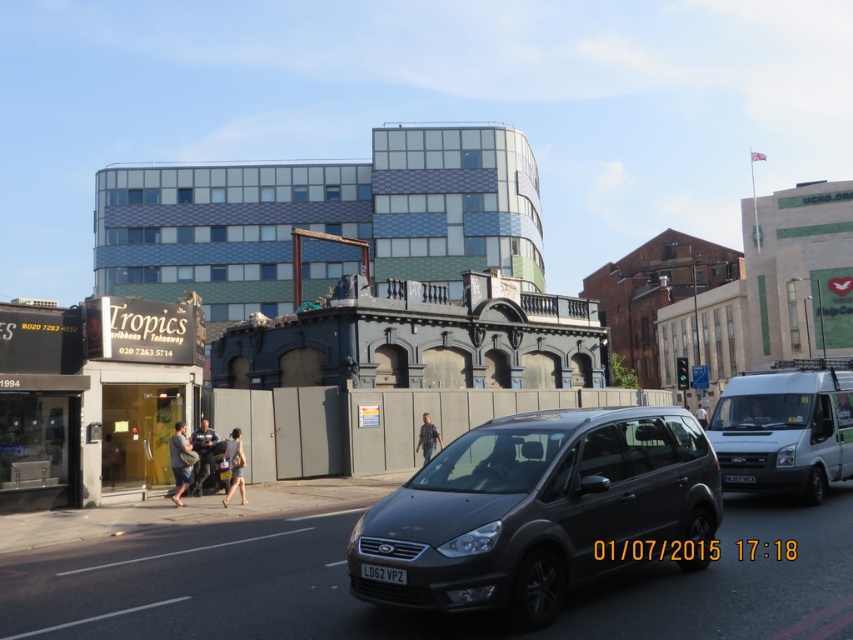
Question: Which of the following is the farthest from the observer?

Choices:
 (A) white matte van at right
 (B) matte black van at center

Answer: (A)

Question: Which point is farther to the camera?

Choices:
 (A) matte black van at center
 (B) white matte van at right

Answer: (B)

Question: Does matte black van at center have a smaller size compared to white matte van at right?

Choices:
 (A) yes
 (B) no

Answer: (A)

Question: Can you confirm if matte black van at center is positioned to the left of white matte van at right?

Choices:
 (A) no
 (B) yes

Answer: (B)

Question: Does matte black van at center appear on the right side of white matte van at right?

Choices:
 (A) no
 (B) yes

Answer: (A)